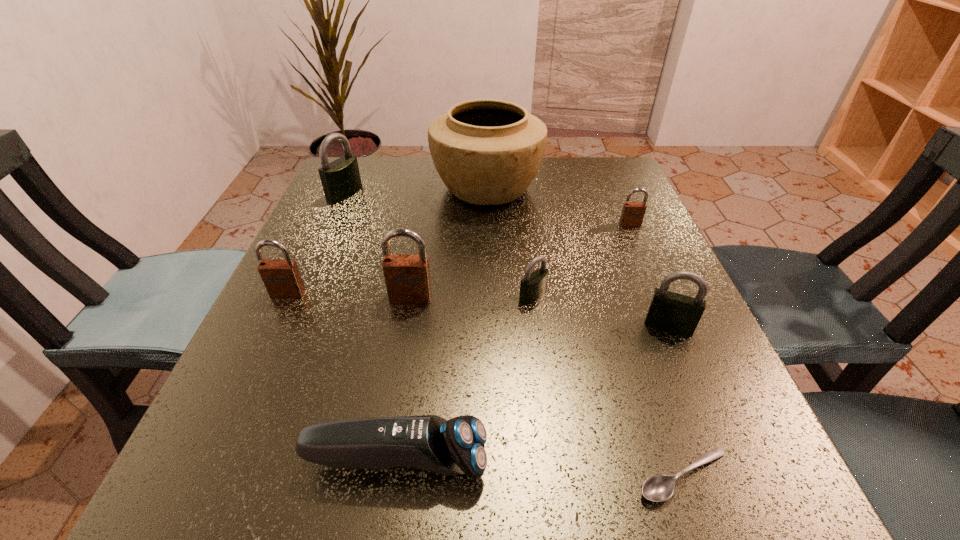
Identify which object is the closest to the third padlock from left to right. Please provide its 2D coordinates. Your answer should be formatted as a tuple, i.e. [(x, y)], where the tuple contains the x and y coordinates of a point satisfying the conditions above.

[(533, 286)]

Point out which padlock is positioned as the fourth nearest to the electric shaver. Please provide its 2D coordinates. Your answer should be formatted as a tuple, i.e. [(x, y)], where the tuple contains the x and y coordinates of a point satisfying the conditions above.

[(670, 312)]

Where is `the second closest padlock to the biggest brown padlock`? the second closest padlock to the biggest brown padlock is located at coordinates (282, 279).

Identify which black padlock is located as the nearest to the rightmost black padlock. Please provide its 2D coordinates. Your answer should be formatted as a tuple, i.e. [(x, y)], where the tuple contains the x and y coordinates of a point satisfying the conditions above.

[(533, 286)]

Find the location of `black padlock that can be found as the third closest to the seventh nearest object`. black padlock that can be found as the third closest to the seventh nearest object is located at coordinates (340, 179).

Locate an element on the screen. brown padlock identified as the closest to the fourth padlock from right to left is located at coordinates (282, 279).

Find the location of `brown padlock that is the closest to the nearest black padlock`. brown padlock that is the closest to the nearest black padlock is located at coordinates (632, 215).

Identify the location of free space that satisfies the following two spatial constraints: 1. on the front-facing side of the second biggest brown padlock; 2. on the left side of the gray soupspoon. pyautogui.click(x=204, y=476).

Locate an element on the screen. vacant space that satisfies the following two spatial constraints: 1. on the front-facing side of the second smallest brown padlock; 2. on the left side of the fourth padlock from left to right is located at coordinates (286, 296).

This screenshot has height=540, width=960. What are the coordinates of `free space that satisfies the following two spatial constraints: 1. on the back side of the gray soupspoon; 2. on the head of the electric shaver` in the screenshot? It's located at (679, 461).